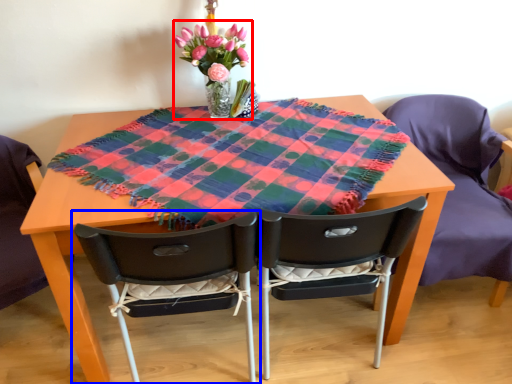
Question: Which object is further to the camera taking this photo, floral arrangement (highlighted by a red box) or chair (highlighted by a blue box)?

Choices:
 (A) floral arrangement
 (B) chair

Answer: (A)